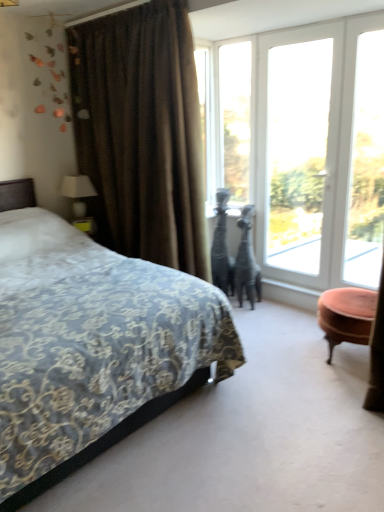
Question: Relative to white fabric lampshade at left, is velvet-patterned bed at left in front or behind?

Choices:
 (A) front
 (B) behind

Answer: (A)

Question: Would you say velvet-patterned bed at left is to the left or to the right of white fabric lampshade at left in the picture?

Choices:
 (A) left
 (B) right

Answer: (B)

Question: Estimate the real-world distances between objects in this image. Which object is closer to the clear glass window at center, the 2th window positioned from the left?

Choices:
 (A) transparent glass window at upper right
 (B) white glass door at center, the second window positioned from the right
 (C) white glass door at upper right, the fourth window viewed from the left
 (D) velvet-patterned bed at left
 (E) velvet pink ottoman at right

Answer: (C)

Question: Estimate the real-world distances between objects in this image. Which object is farther from the white glass door at center, placed as the 3th window when sorted from left to right?

Choices:
 (A) white fabric lampshade at left
 (B) transparent glass window at upper center, the first window when ordered from left to right
 (C) velvet pink ottoman at right
 (D) brown velvet curtain at left
 (E) white glass door at upper right, placed as the 1th window when sorted from right to left

Answer: (A)